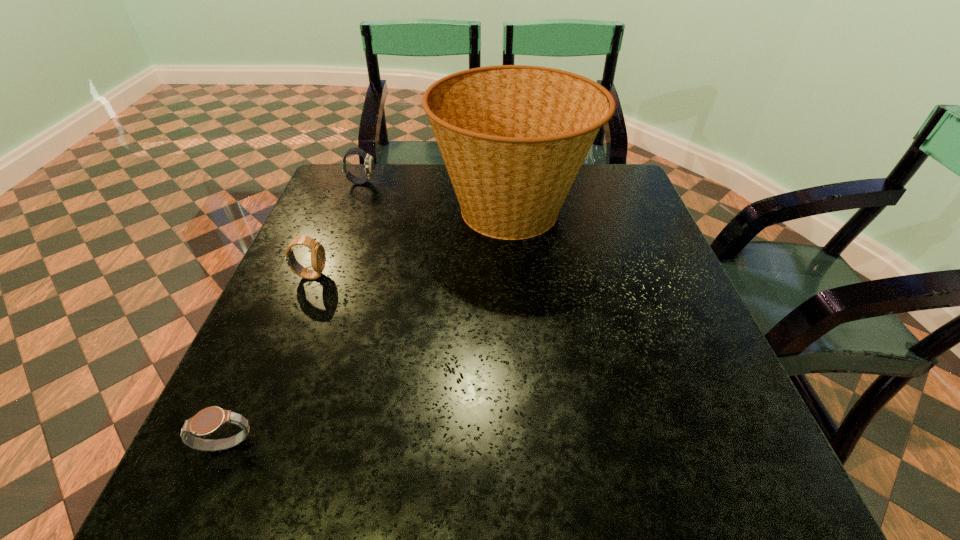
Identify the location of vacant area at the right edge. This screenshot has width=960, height=540. (640, 323).

The image size is (960, 540). In order to click on vacant space at the far right corner of the desktop in this screenshot , I will do `click(605, 165)`.

You are a GUI agent. You are given a task and a screenshot of the screen. Output one action in this format:
    pyautogui.click(x=<x>, y=<y>)
    Task: Click on the free spot between the basket and the nearest object
    The image size is (960, 540).
    Given the screenshot: What is the action you would take?
    pyautogui.click(x=369, y=328)

Locate an element on the screen. The image size is (960, 540). empty location between the shortest watch and the third farthest object is located at coordinates (269, 361).

At what (x,y) coordinates should I click in order to perform the action: click on vacant space that's between the basket and the farthest watch. Please return your answer as a coordinate pair (x, y). Looking at the image, I should click on (437, 196).

Locate an element on the screen. Image resolution: width=960 pixels, height=540 pixels. free space between the second nearest object and the farthest watch is located at coordinates pyautogui.click(x=336, y=229).

Identify the location of vacant point located between the shortest object and the second nearest object. (269, 361).

Where is `free space between the second nearest object and the tallest object`? free space between the second nearest object and the tallest object is located at coordinates point(411,242).

Find the location of a particular element. vacant area that lies between the basket and the third farthest object is located at coordinates (411, 242).

The width and height of the screenshot is (960, 540). What are the coordinates of `vacant area that lies between the tallest object and the nearest watch` in the screenshot? It's located at (369, 328).